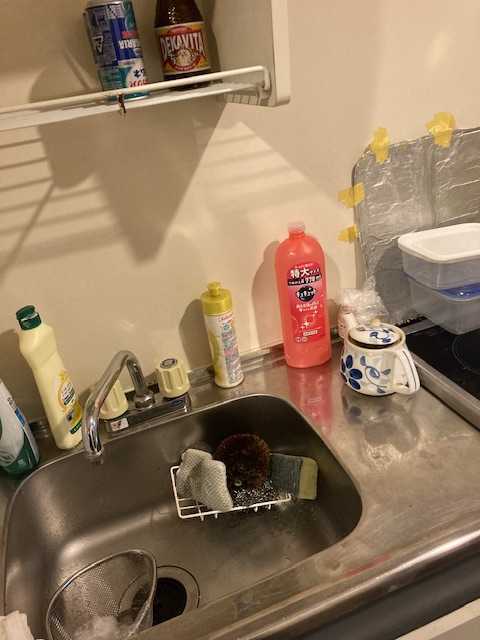
Where is `measuring cup`? The width and height of the screenshot is (480, 640). measuring cup is located at coordinates coord(127,582).